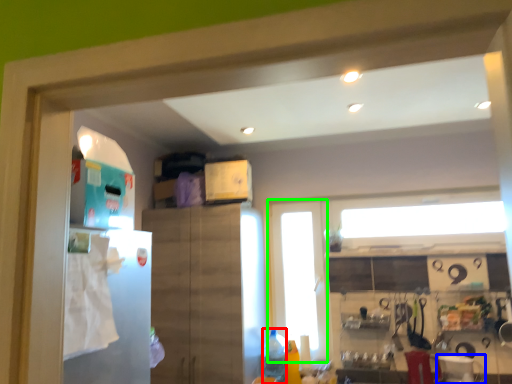
Question: Based on their relative distances, which object is nearer to bottle (highlighted by a red box)? Choose from appliance (highlighted by a blue box) and glass door (highlighted by a green box).

Choices:
 (A) appliance
 (B) glass door

Answer: (B)